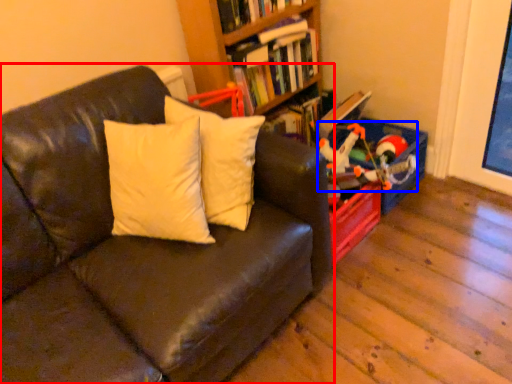
Question: Among these objects, which one is nearest to the camera, studio couch (highlighted by a red box) or toy (highlighted by a blue box)?

Choices:
 (A) studio couch
 (B) toy

Answer: (A)